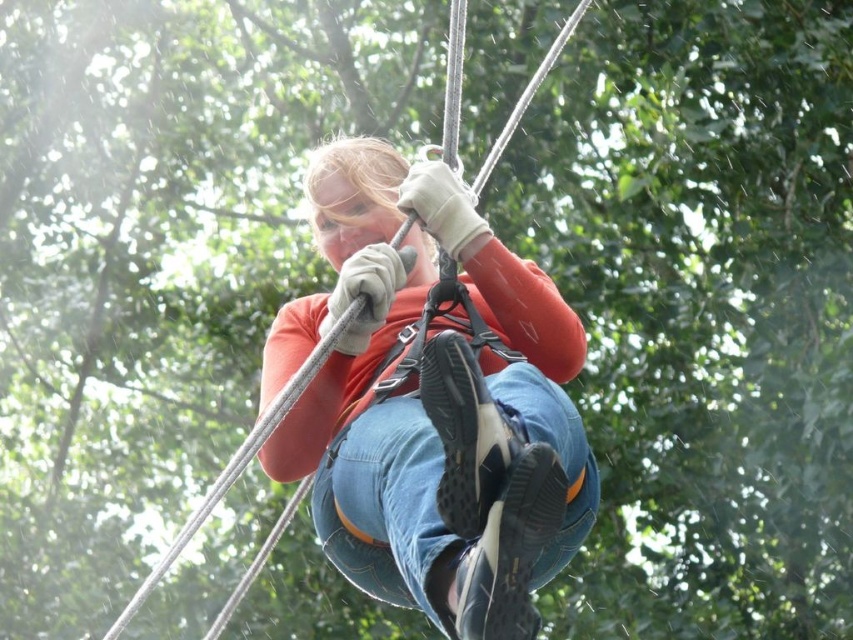
Is matte orange shirt at center positioned in front of denim at center?

No, it is behind denim at center.

Measure the distance between point (281, 426) and camera.

Point (281, 426) and camera are 10.33 meters apart.

Does point (521, 376) come farther from viewer compared to point (376, 420)?

No.

Locate an element on the screen. The width and height of the screenshot is (853, 640). matte orange shirt at center is located at coordinates (422, 394).